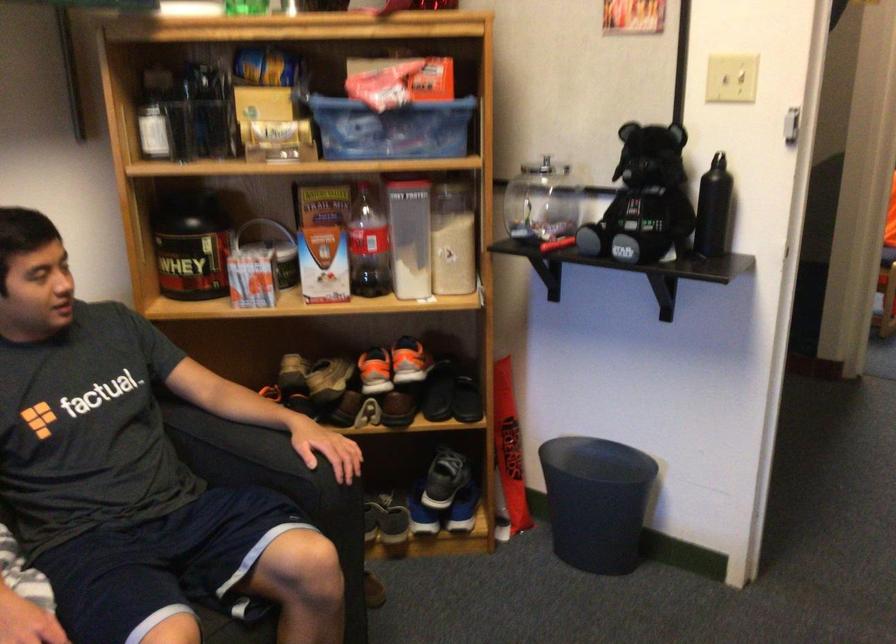
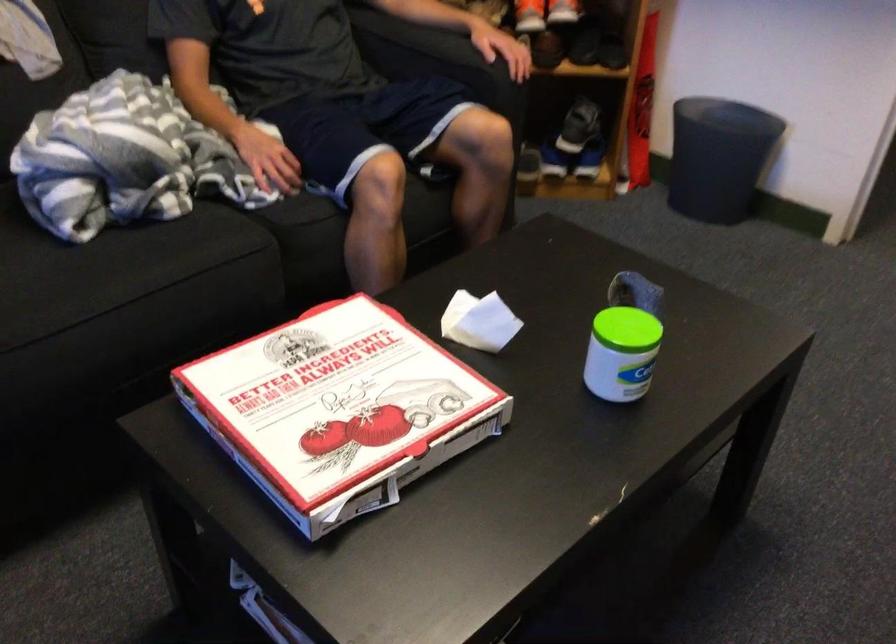
Question: The first image is from the beginning of the video and the second image is from the end. How did the camera likely rotate when shooting the video?

Choices:
 (A) Left
 (B) Right
 (C) Up
 (D) Down

Answer: (D)